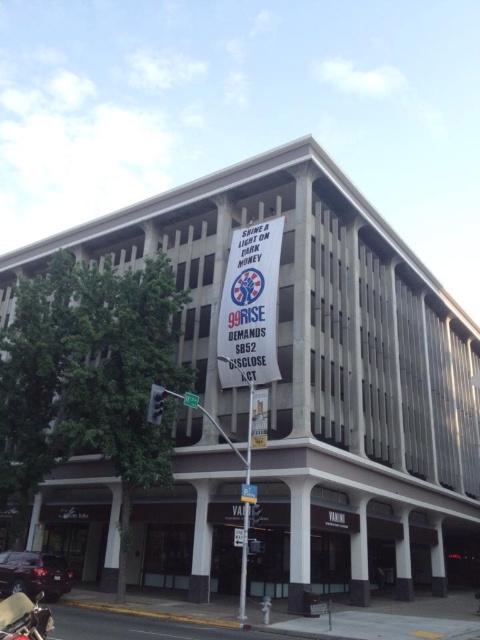
You are a photographer standing at the entrance of the building. You want to capture both the shiny chrome motorcycle at lower left and the metallic pole at center in your shot. Which object will appear larger in your photo?

The shiny chrome motorcycle at lower left will appear larger in the photo because it is bigger than the metallic pole at center.

You are standing in front of the building and want to take a photo of the banner. Which point, point (242, 616) or point (187, 401), is closer to your camera lens?

Point (242, 616) is closer to the camera than point (187, 401).